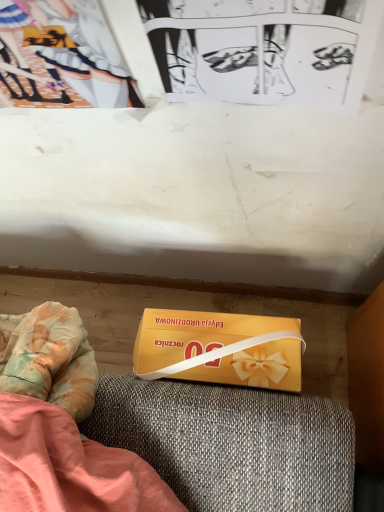
Where is `vacant point above yellow matte box at lower center (from a real-world perspective)`? The image size is (384, 512). vacant point above yellow matte box at lower center (from a real-world perspective) is located at coordinates (225, 346).